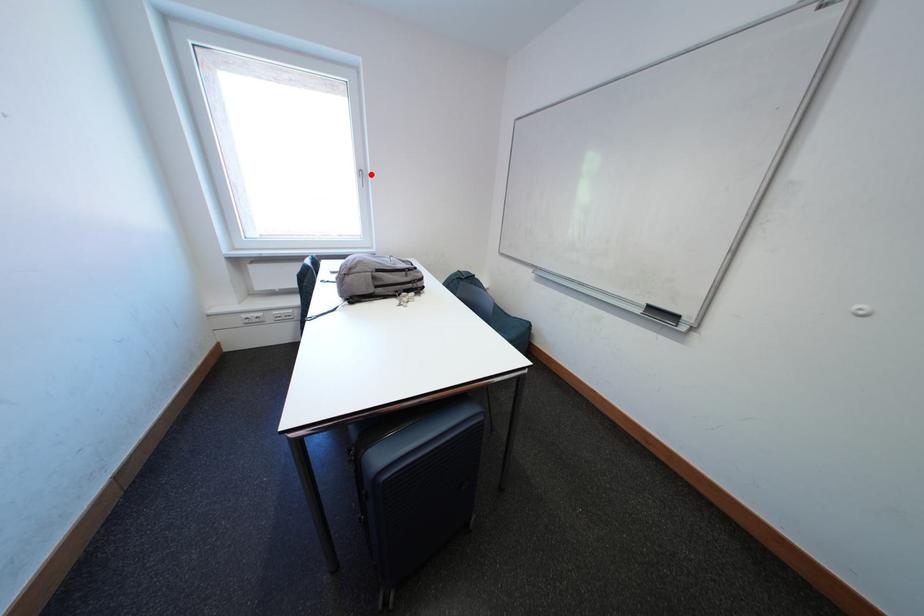
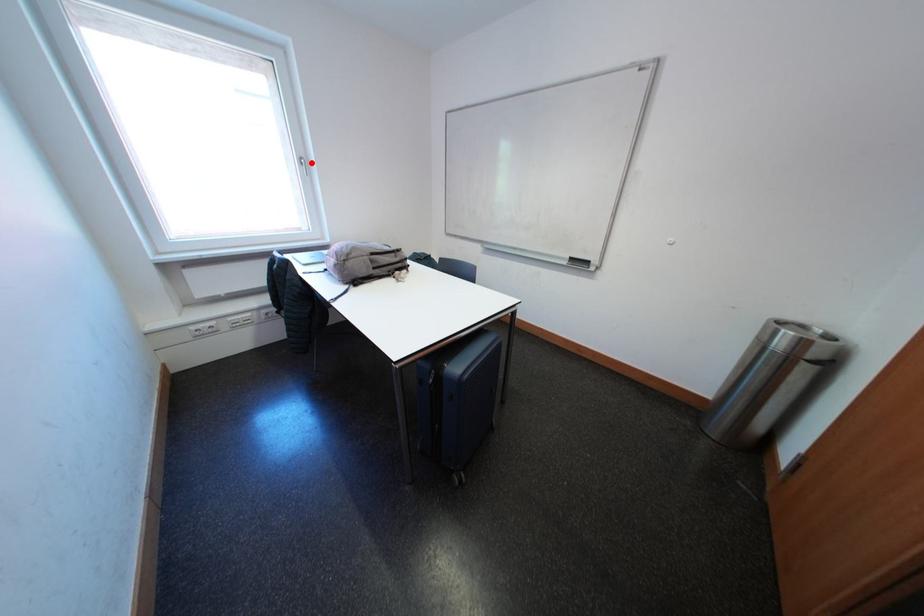
I am providing you with two images of the same scene from different viewpoints. A red point is marked on the first image and another point is marked on the second image. Is the red point in image1 aligned with the point shown in image2?

Yes